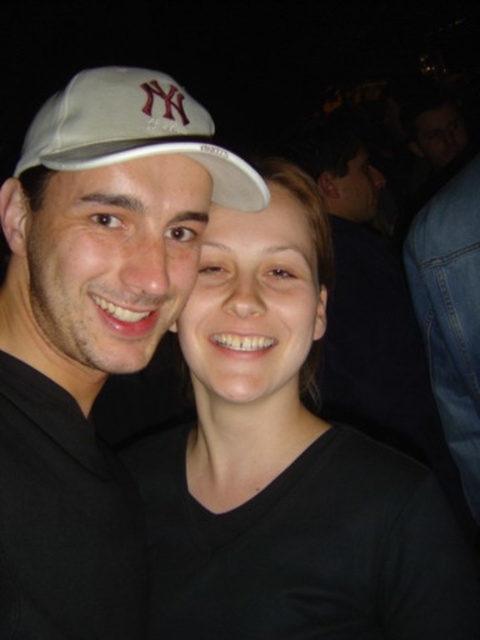
Can you confirm if black matte shirt at center is thinner than white matte cap at left?

In fact, black matte shirt at center might be wider than white matte cap at left.

At what (x,y) coordinates should I click in order to perform the action: click on black matte shirt at center. Please return your answer as a coordinate pair (x, y). Looking at the image, I should click on (286, 467).

Find the location of a particular element. black matte shirt at center is located at coordinates (286, 467).

Which is above, black matte shirt at center or white matte baseball cap at upper left?

white matte baseball cap at upper left is higher up.

Who is more distant from viewer, (250,438) or (76,164)?

The point (250,438) is more distant.

In order to click on black matte shirt at center in this screenshot , I will do `click(286, 467)`.

Does white matte cap at left have a lesser height compared to white matte baseball cap at upper left?

No, white matte cap at left is not shorter than white matte baseball cap at upper left.

Is white matte cap at left bigger than white matte baseball cap at upper left?

Correct, white matte cap at left is larger in size than white matte baseball cap at upper left.

Who is more distant from viewer, (99, 320) or (133, 122)?

Point (99, 320)

Where is `white matte cap at left`? The height and width of the screenshot is (640, 480). white matte cap at left is located at coordinates pyautogui.click(x=92, y=326).